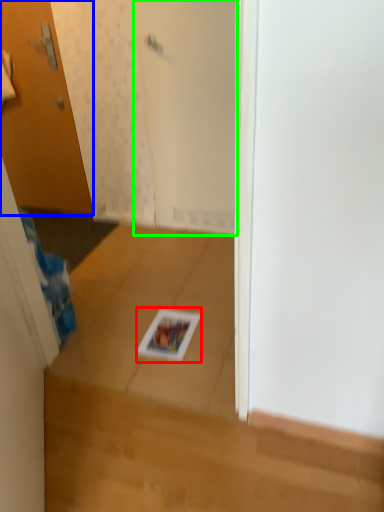
Question: Which is nearer to the magazine (highlighted by a red box)? door (highlighted by a blue box) or screen door (highlighted by a green box).

Choices:
 (A) door
 (B) screen door

Answer: (B)